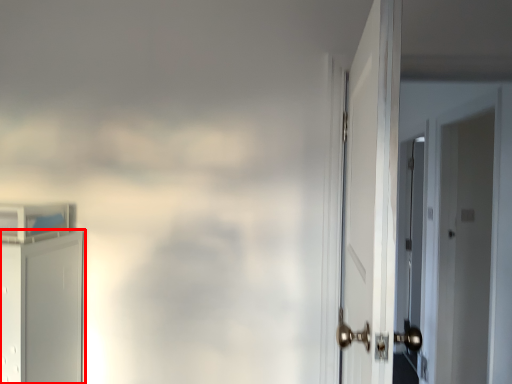
Question: Where is door (annotated by the red box) located in relation to door in the image?

Choices:
 (A) left
 (B) right

Answer: (A)